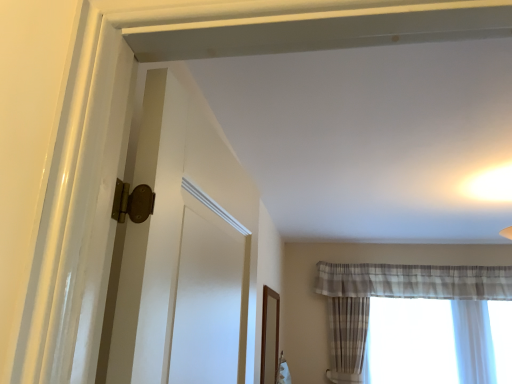
Question: Is plaid sheer curtain at right spatially inside plaid fabric curtain at right, or outside of it?

Choices:
 (A) outside
 (B) inside

Answer: (A)

Question: From the image's perspective, is plaid sheer curtain at right above or below plaid fabric curtain at right?

Choices:
 (A) above
 (B) below

Answer: (A)

Question: From a real-world perspective, is plaid sheer curtain at right physically located above or below plaid fabric curtain at right?

Choices:
 (A) above
 (B) below

Answer: (A)

Question: Based on their positions, is plaid fabric curtain at right located to the left or right of plaid sheer curtain at right?

Choices:
 (A) right
 (B) left

Answer: (A)

Question: From a real-world perspective, is plaid fabric curtain at right physically located above or below plaid sheer curtain at right?

Choices:
 (A) below
 (B) above

Answer: (A)

Question: Is plaid fabric curtain at right wider or thinner than plaid sheer curtain at right?

Choices:
 (A) wide
 (B) thin

Answer: (A)

Question: From their relative heights in the image, would you say plaid fabric curtain at right is taller or shorter than plaid sheer curtain at right?

Choices:
 (A) tall
 (B) short

Answer: (B)